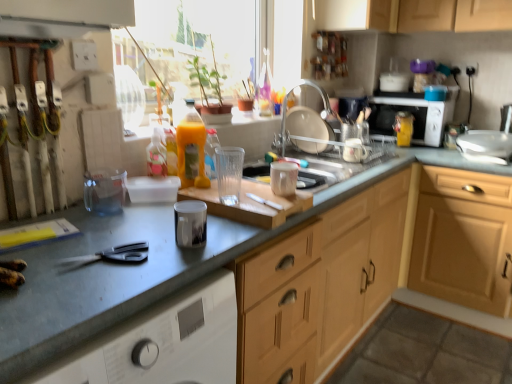
Locate an element on the screen. This screenshot has width=512, height=384. free location to the right of black plastic scissors at lower left is located at coordinates [x=169, y=261].